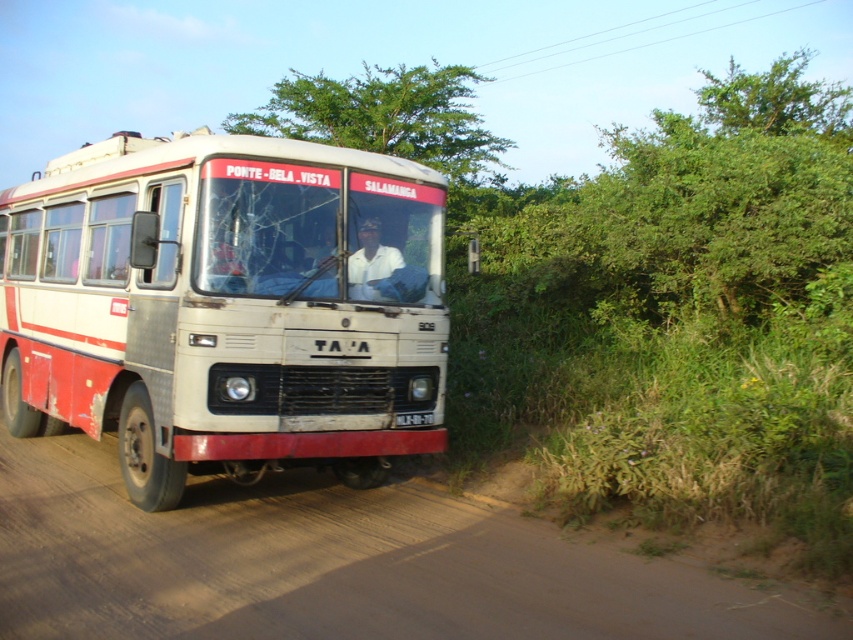
You are standing at the back of the vintage bus labeled TA A. You want to walk to the front of the bus. Which point should you walk towards first, point (381,307) or point (374,244)?

You should walk towards point (374,244) first because point (381,307) is in front of point (374,244), so point (374,244) is closer to the back of the bus where you are standing.

Consider the image. You are a passenger on the vintage bus and looking out the window. You notice a green leafy tree at upper center and a black plastic license plate at center. Which object is closer to you?

The black plastic license plate at center is behind the green leafy tree at upper center, so the green leafy tree at upper center is closer to you.

You are a passenger on the vintage bus and looking out the window. You see a green leafy tree at upper center and a black plastic license plate at center. Which object is taller?

The green leafy tree at upper center is taller than the black plastic license plate at center.